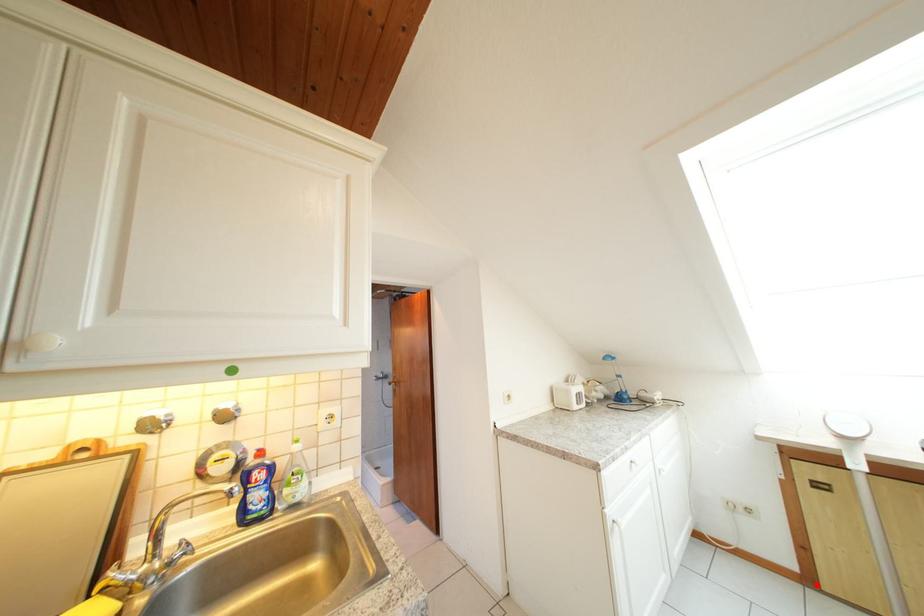
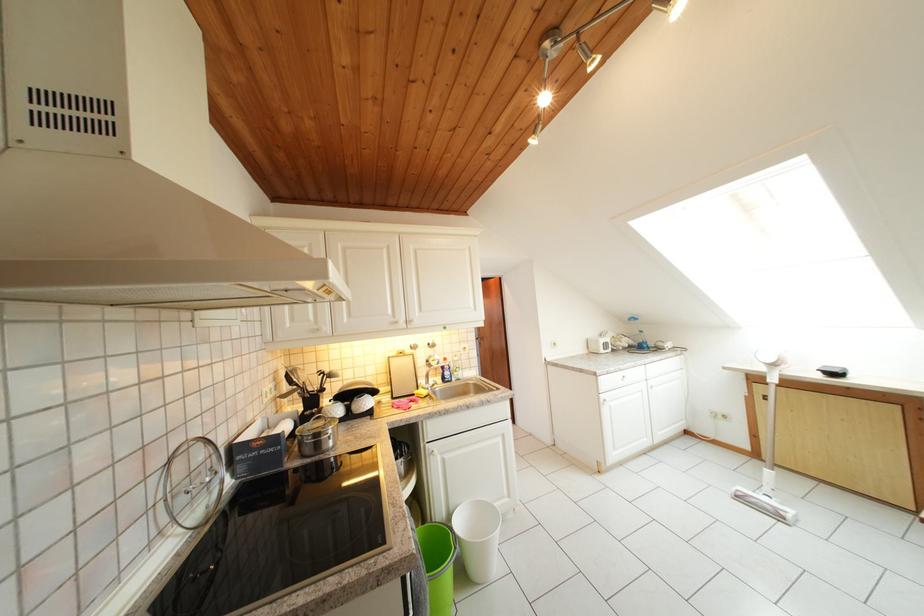
In the second image, find the point that corresponds to the highlighted location in the first image.

(764, 460)